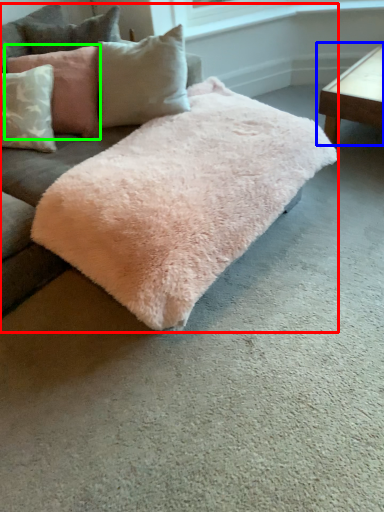
Question: Which object is positioned closest to studio couch (highlighted by a red box)? Select from table (highlighted by a blue box) and pillow (highlighted by a green box).

Choices:
 (A) table
 (B) pillow

Answer: (B)